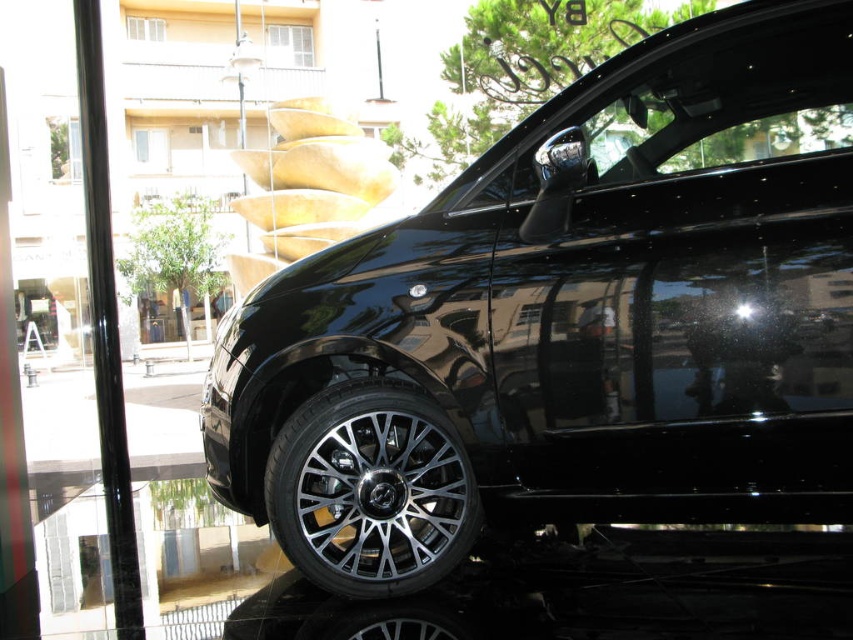
Does transparent glass door at left come in front of black polished wheel at lower center?

No, transparent glass door at left is behind black polished wheel at lower center.

Which is behind, point (51, 307) or point (368, 637)?

The point (51, 307) is more distant.

This screenshot has height=640, width=853. In order to click on transparent glass door at left in this screenshot , I will do click(61, 330).

Between glossy black car at center and transparent glass door at left, which one appears on the left side from the viewer's perspective?

transparent glass door at left is more to the left.

Does glossy black car at center have a greater width compared to transparent glass door at left?

Incorrect, glossy black car at center's width does not surpass transparent glass door at left's.

Is point (831, 429) more distant than point (82, 358)?

No, (831, 429) is closer to viewer.

Where is `glossy black car at center`? glossy black car at center is located at coordinates (570, 321).

Is point (577, 339) behind point (325, 630)?

Yes, point (577, 339) is farther from viewer.

Does glossy black car at center have a greater width compared to black polished wheel at lower center?

Correct, the width of glossy black car at center exceeds that of black polished wheel at lower center.

Who is more distant from viewer, (825, 113) or (405, 621)?

Positioned behind is point (405, 621).

Find the location of a particular element. Image resolution: width=853 pixels, height=640 pixels. glossy black car at center is located at coordinates (570, 321).